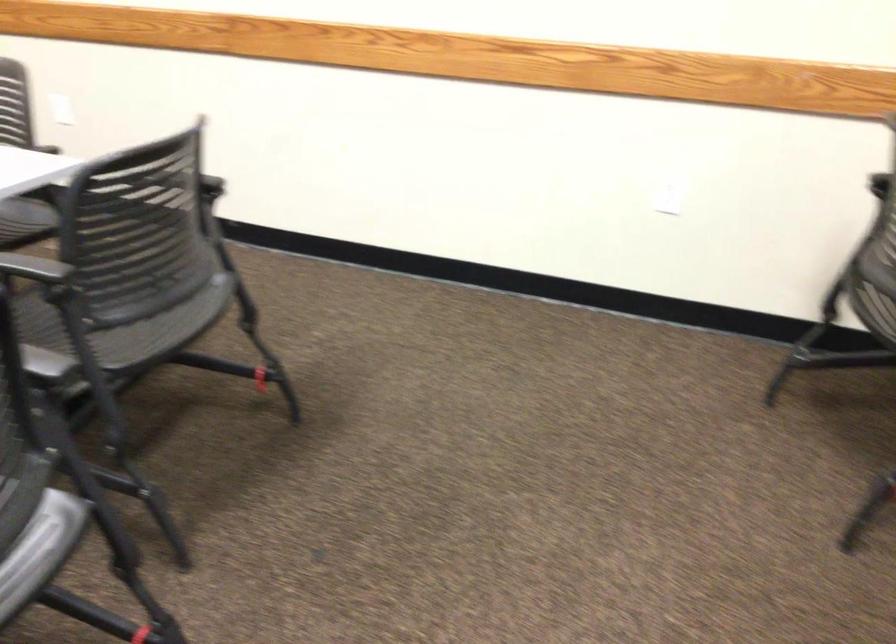
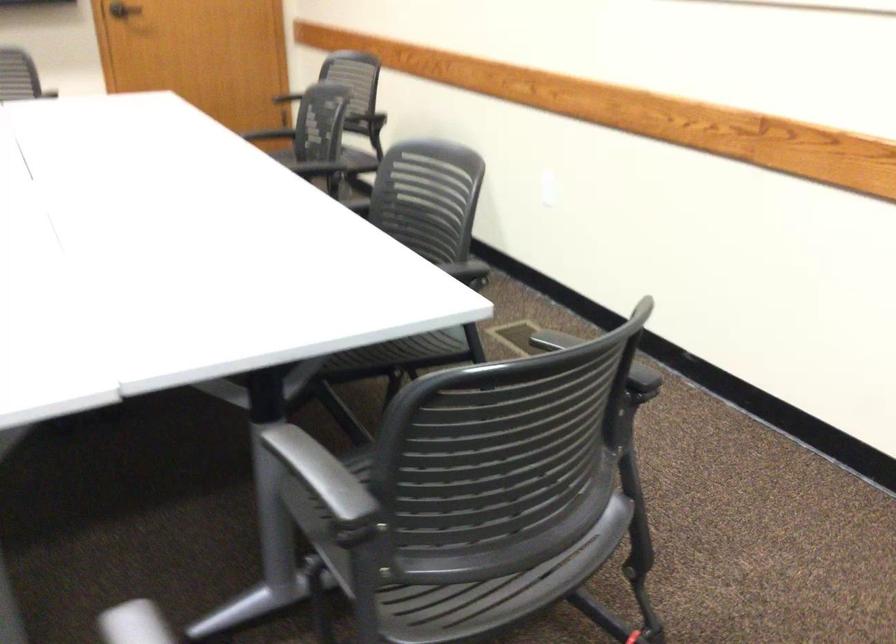
Question: The camera is either moving clockwise (left) or counter-clockwise (right) around the object. The first image is from the beginning of the video and the second image is from the end. Is the camera moving left or right when shooting the video?

Choices:
 (A) Left
 (B) Right

Answer: (B)